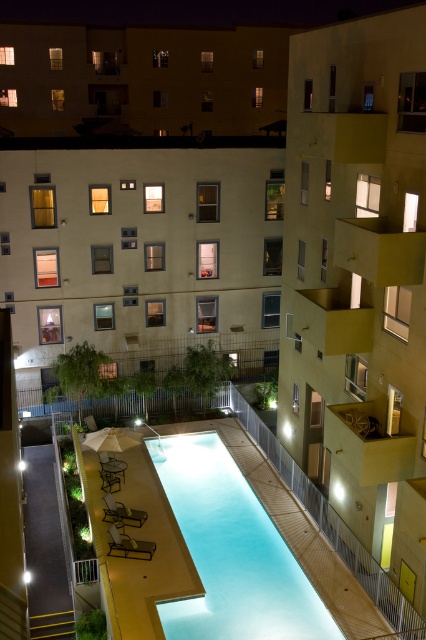
Who is higher up, yellow concrete balcony at upper right or smooth concrete pool at center?

Positioned higher is yellow concrete balcony at upper right.

Between yellow concrete balcony at upper right and smooth concrete pool at center, which one appears on the left side from the viewer's perspective?

Positioned to the left is smooth concrete pool at center.

Where is `yellow concrete balcony at upper right`? This screenshot has width=426, height=640. yellow concrete balcony at upper right is located at coordinates (359, 284).

Where is `yellow concrete balcony at upper right`? The width and height of the screenshot is (426, 640). yellow concrete balcony at upper right is located at coordinates click(x=359, y=284).

Does yellow concrete balcony at upper right have a lesser height compared to beige concrete building at center?

In fact, yellow concrete balcony at upper right may be taller than beige concrete building at center.

Which of these two, yellow concrete balcony at upper right or beige concrete building at center, stands taller?

With more height is yellow concrete balcony at upper right.

Does point (354, 540) come farther from viewer compared to point (186, 292)?

No.

This screenshot has height=640, width=426. Find the location of `yellow concrete balcony at upper right`. yellow concrete balcony at upper right is located at coordinates (359, 284).

Is beige concrete building at center smaller than smooth concrete pool at center?

Incorrect, beige concrete building at center is not smaller in size than smooth concrete pool at center.

Is point (158, 209) positioned before point (178, 602)?

No, it is not.

The image size is (426, 640). What are the coordinates of `beige concrete building at center` in the screenshot? It's located at (141, 250).